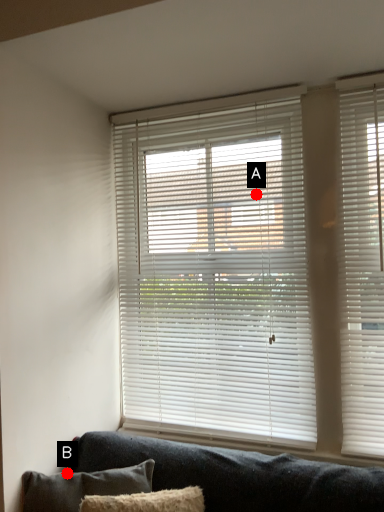
Question: Two points are circled on the image, labeled by A and B beside each circle. Which point is farther to the camera?

Choices:
 (A) A is further
 (B) B is further

Answer: (A)